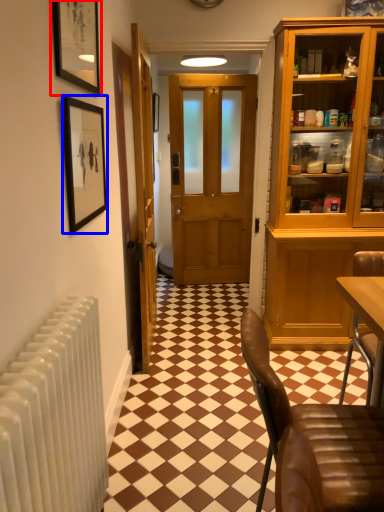
Question: Which point is further to the camera, picture frame (highlighted by a red box) or picture frame (highlighted by a blue box)?

Choices:
 (A) picture frame
 (B) picture frame

Answer: (B)